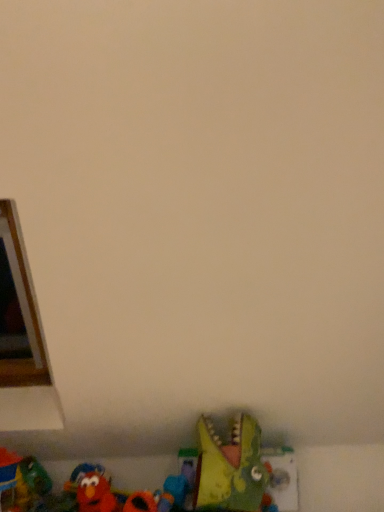
What is the approximate width of green plastic dinosaur at lower center, acting as the 5th toy starting from the left?

green plastic dinosaur at lower center, acting as the 5th toy starting from the left, is 11.84 inches in width.

You are a GUI agent. You are given a task and a screenshot of the screen. Output one action in this format:
    pyautogui.click(x=<x>, y=<y>)
    Task: Click on the green plastic dinosaur at lower center, acting as the 5th toy starting from the left
    This screenshot has height=512, width=384.
    Given the screenshot: What is the action you would take?
    pyautogui.click(x=230, y=467)

What do you see at coordinates (8, 476) in the screenshot? I see `rubber duck at lower left, which appears as the 1th toy when viewed from the left` at bounding box center [8, 476].

This screenshot has height=512, width=384. Identify the location of rubber duck at lower left, which appears as the 1th toy when viewed from the left. (8, 476).

The height and width of the screenshot is (512, 384). Describe the element at coordinates (21, 482) in the screenshot. I see `rubberized red toy at lower left, which is the 2th toy from left to right` at that location.

Where is `green plastic dinosaur at lower center, acting as the 5th toy starting from the left`? The width and height of the screenshot is (384, 512). green plastic dinosaur at lower center, acting as the 5th toy starting from the left is located at coordinates (230, 467).

Is velvety red elmo at lower left, acting as the third toy starting from the left, positioned with its back to rubberized red toy at lower left, which is the 2th toy from left to right?

That's not correct — velvety red elmo at lower left, acting as the third toy starting from the left, is not looking away from rubberized red toy at lower left, which is the 2th toy from left to right.

Is velvety red elmo at lower left, positioned as the 3th toy in right-to-left order, with rubberized red toy at lower left, arranged as the fourth toy when viewed from the right?

No, velvety red elmo at lower left, positioned as the 3th toy in right-to-left order, is not in contact with rubberized red toy at lower left, arranged as the fourth toy when viewed from the right.

Is the depth of velvety red elmo at lower left, positioned as the 3th toy in right-to-left order, less than that of rubberized red toy at lower left, arranged as the fourth toy when viewed from the right?

Yes, it is.

From the picture: Between velvety red elmo at lower left, positioned as the 3th toy in right-to-left order, and rubberized red toy at lower left, which is the 2th toy from left to right, which one has larger size?

rubberized red toy at lower left, which is the 2th toy from left to right.

Is green plastic dinosaur at lower center, the first toy positioned from the right, not inside rubber duck at lower center, which is the 2th toy in right-to-left order?

Yes.

Measure the distance between green plastic dinosaur at lower center, the first toy positioned from the right, and rubber duck at lower center, which is the fourth toy in left-to-right order.

green plastic dinosaur at lower center, the first toy positioned from the right, and rubber duck at lower center, which is the fourth toy in left-to-right order, are 15.51 centimeters apart from each other.

Is green plastic dinosaur at lower center, acting as the 5th toy starting from the left, to the left or to the right of rubber duck at lower center, which is the fourth toy in left-to-right order, in the image?

Clearly, green plastic dinosaur at lower center, acting as the 5th toy starting from the left, is on the right of rubber duck at lower center, which is the fourth toy in left-to-right order, in the image.

Considering the positions of point (206, 450) and point (183, 460), is point (206, 450) closer or farther from the camera than point (183, 460)?

Point (206, 450).

Is rubberized red toy at lower left, arranged as the fourth toy when viewed from the right, not inside velvety red elmo at lower left, positioned as the 3th toy in right-to-left order?

rubberized red toy at lower left, arranged as the fourth toy when viewed from the right, lies outside velvety red elmo at lower left, positioned as the 3th toy in right-to-left order,'s area.

From the image's perspective, who appears lower, rubberized red toy at lower left, arranged as the fourth toy when viewed from the right, or velvety red elmo at lower left, positioned as the 3th toy in right-to-left order?

velvety red elmo at lower left, positioned as the 3th toy in right-to-left order, is shown below in the image.

Between rubberized red toy at lower left, which is the 2th toy from left to right, and velvety red elmo at lower left, acting as the third toy starting from the left, which one has less height?

Standing shorter between the two is velvety red elmo at lower left, acting as the third toy starting from the left.

Is point (9, 484) positioned in front of point (83, 487)?

Yes, it is in front of point (83, 487).

In the scene shown: From a real-world perspective, which object stands above the other?

In real-world perspective, green plastic dinosaur at lower center, acting as the 5th toy starting from the left, is above.

Based on the photo, is green plastic dinosaur at lower center, acting as the 5th toy starting from the left, far from rubber duck at lower left, which appears as the 1th toy when viewed from the left?

green plastic dinosaur at lower center, acting as the 5th toy starting from the left, is actually quite close to rubber duck at lower left, which appears as the 1th toy when viewed from the left.

Does green plastic dinosaur at lower center, the first toy positioned from the right, have a larger size compared to rubber duck at lower left, which ranks as the 5th toy in right-to-left order?

Yes.

How far apart are green plastic dinosaur at lower center, acting as the 5th toy starting from the left, and rubber duck at lower left, which ranks as the 5th toy in right-to-left order?

79.29 centimeters.

Who is more distant, green plastic dinosaur at lower center, acting as the 5th toy starting from the left, or velvety red elmo at lower left, acting as the third toy starting from the left?

green plastic dinosaur at lower center, acting as the 5th toy starting from the left, is further from the camera.

Does green plastic dinosaur at lower center, acting as the 5th toy starting from the left, have a larger size compared to velvety red elmo at lower left, acting as the third toy starting from the left?

Yes, green plastic dinosaur at lower center, acting as the 5th toy starting from the left, is bigger than velvety red elmo at lower left, acting as the third toy starting from the left.

Looking at this image, from a real-world perspective, which is physically above, green plastic dinosaur at lower center, acting as the 5th toy starting from the left, or velvety red elmo at lower left, acting as the third toy starting from the left?

In real-world perspective, green plastic dinosaur at lower center, acting as the 5th toy starting from the left, is above.

Is green plastic dinosaur at lower center, the first toy positioned from the right, placed right next to velvety red elmo at lower left, positioned as the 3th toy in right-to-left order?

No, green plastic dinosaur at lower center, the first toy positioned from the right, is not making contact with velvety red elmo at lower left, positioned as the 3th toy in right-to-left order.

From a real-world perspective, is velvety red elmo at lower left, acting as the third toy starting from the left, under green plastic dinosaur at lower center, the first toy positioned from the right?

Indeed, from a real-world perspective, velvety red elmo at lower left, acting as the third toy starting from the left, is positioned beneath green plastic dinosaur at lower center, the first toy positioned from the right.

Where is `the 2nd toy counting from the left side of the green plastic dinosaur at lower center, the first toy positioned from the right`? the 2nd toy counting from the left side of the green plastic dinosaur at lower center, the first toy positioned from the right is located at coordinates coord(92,489).

Who is taller, velvety red elmo at lower left, positioned as the 3th toy in right-to-left order, or green plastic dinosaur at lower center, acting as the 5th toy starting from the left?

Standing taller between the two is green plastic dinosaur at lower center, acting as the 5th toy starting from the left.

Does point (100, 486) come behind point (228, 494)?

Yes, it is behind point (228, 494).

Is velvety red elmo at lower left, acting as the third toy starting from the left, facing towards rubber duck at lower center, which is the 2th toy in right-to-left order?

No, velvety red elmo at lower left, acting as the third toy starting from the left, is not turned towards rubber duck at lower center, which is the 2th toy in right-to-left order.

Is velvety red elmo at lower left, positioned as the 3th toy in right-to-left order, to the left or to the right of rubber duck at lower center, which is the 2th toy in right-to-left order, in the image?

Based on their positions, velvety red elmo at lower left, positioned as the 3th toy in right-to-left order, is located to the left of rubber duck at lower center, which is the 2th toy in right-to-left order.

From the picture: Which is less distant, (79, 479) or (169, 490)?

Point (79, 479) is farther from the camera than point (169, 490).

From the velvety red elmo at lower left, positioned as the 3th toy in right-to-left order, count 1st toys backward and point to it. Please provide its 2D coordinates.

[(21, 482)]

Locate an element on the screen. the 3rd toy above the rubber duck at lower center, which is the fourth toy in left-to-right order (from a real-world perspective) is located at coordinates (230, 467).

When comparing their distances from rubberized red toy at lower left, which is the 2th toy from left to right, does green plastic dinosaur at lower center, acting as the 5th toy starting from the left, or rubber duck at lower left, which appears as the 1th toy when viewed from the left, seem further?

Based on the image, green plastic dinosaur at lower center, acting as the 5th toy starting from the left, appears to be further to rubberized red toy at lower left, which is the 2th toy from left to right.

Considering their positions, is rubberized red toy at lower left, which is the 2th toy from left to right, positioned closer to rubber duck at lower left, which appears as the 1th toy when viewed from the left, than velvety red elmo at lower left, positioned as the 3th toy in right-to-left order?

Based on the image, rubberized red toy at lower left, which is the 2th toy from left to right, appears to be nearer to rubber duck at lower left, which appears as the 1th toy when viewed from the left.

When comparing their distances from rubber duck at lower center, which is the 2th toy in right-to-left order, does rubber duck at lower left, which appears as the 1th toy when viewed from the left, or rubberized red toy at lower left, arranged as the fourth toy when viewed from the right, seem closer?

rubberized red toy at lower left, arranged as the fourth toy when viewed from the right, lies closer to rubber duck at lower center, which is the 2th toy in right-to-left order, than the other object.

Based on the photo, considering their positions, is rubber duck at lower center, which is the fourth toy in left-to-right order, positioned further to rubber duck at lower left, which appears as the 1th toy when viewed from the left, than green plastic dinosaur at lower center, the first toy positioned from the right?

green plastic dinosaur at lower center, the first toy positioned from the right, is further to rubber duck at lower left, which appears as the 1th toy when viewed from the left.

Which object lies nearer to the anchor point velvety red elmo at lower left, positioned as the 3th toy in right-to-left order, rubber duck at lower left, which ranks as the 5th toy in right-to-left order, or green plastic dinosaur at lower center, the first toy positioned from the right?

Based on the image, rubber duck at lower left, which ranks as the 5th toy in right-to-left order, appears to be nearer to velvety red elmo at lower left, positioned as the 3th toy in right-to-left order.

Estimate the real-world distances between objects in this image. Which object is further from green plastic dinosaur at lower center, acting as the 5th toy starting from the left, velvety red elmo at lower left, positioned as the 3th toy in right-to-left order, or rubberized red toy at lower left, which is the 2th toy from left to right?

rubberized red toy at lower left, which is the 2th toy from left to right.

Looking at the image, which one is located further to rubber duck at lower center, which is the 2th toy in right-to-left order, rubberized red toy at lower left, which is the 2th toy from left to right, or velvety red elmo at lower left, acting as the third toy starting from the left?

The object further to rubber duck at lower center, which is the 2th toy in right-to-left order, is rubberized red toy at lower left, which is the 2th toy from left to right.

Considering their positions, is rubber duck at lower center, which is the 2th toy in right-to-left order, positioned closer to rubber duck at lower left, which appears as the 1th toy when viewed from the left, than rubberized red toy at lower left, arranged as the fourth toy when viewed from the right?

rubberized red toy at lower left, arranged as the fourth toy when viewed from the right.

This screenshot has height=512, width=384. Identify the location of toy located between velvety red elmo at lower left, positioned as the 3th toy in right-to-left order, and green plastic dinosaur at lower center, acting as the 5th toy starting from the left, in the left-right direction. (180, 482).

This screenshot has width=384, height=512. I want to click on toy located between rubberized red toy at lower left, arranged as the fourth toy when viewed from the right, and rubber duck at lower center, which is the 2th toy in right-to-left order, in the left-right direction, so click(x=92, y=489).

Find the location of a particular element. toy between rubber duck at lower left, which ranks as the 5th toy in right-to-left order, and velvety red elmo at lower left, acting as the third toy starting from the left, from left to right is located at coordinates (21, 482).